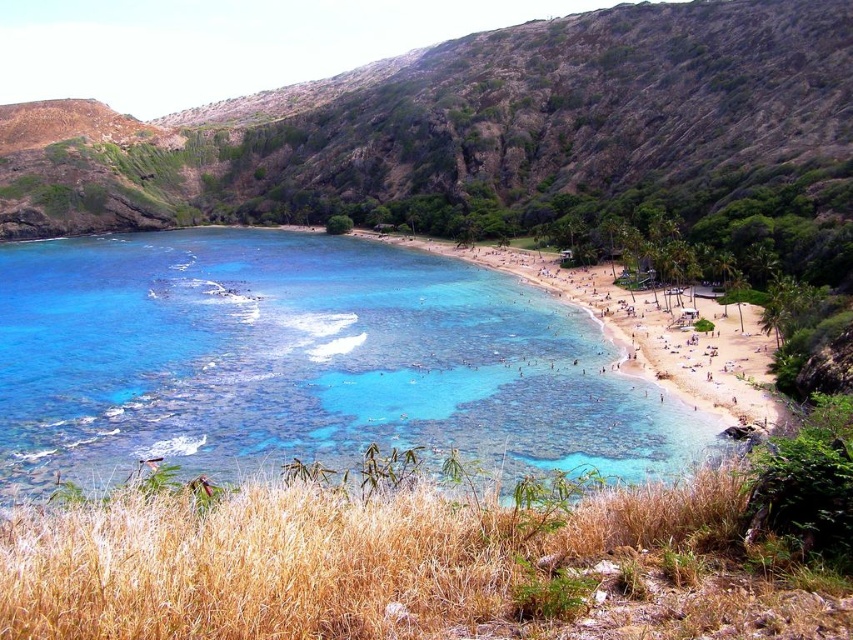
You are standing on the sandy beach at lower right and want to wade into the clear blue water at center. According to the scene, which direction should you move to reach the water?

The clear blue water at center is positioned under the sandy beach at lower right, so you should move upward from the sandy beach at lower right towards the clear blue water at center to reach the water.

You are planning to build a small sandcastle on the beach. Given that the sandy beach at lower right is smaller than the clear blue water at center, where should you build it to ensure it stays dry and away from the water?

You should build the sandcastle on the sandy beach at lower right because it is smaller and farther from the larger clear blue water at center, reducing the risk of water reaching it.